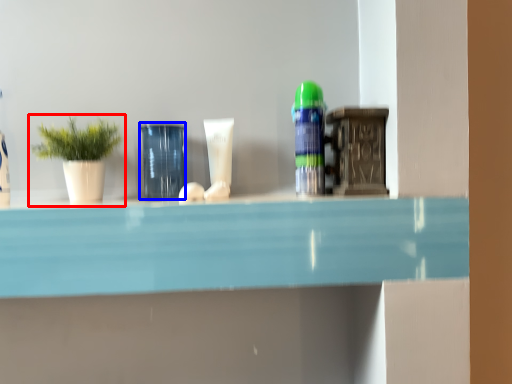
Question: Which point is closer to the camera, houseplant (highlighted by a red box) or glass vase (highlighted by a blue box)?

Choices:
 (A) houseplant
 (B) glass vase

Answer: (A)